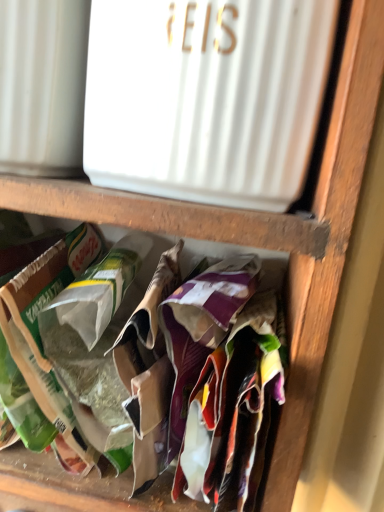
In order to face multicolored plastic bags at center, should I rotate leftwards or rightwards?

Rotate left and turn 13.545 degrees.

The image size is (384, 512). What do you see at coordinates (104, 397) in the screenshot?
I see `multicolored plastic bags at center` at bounding box center [104, 397].

What is the approximate width of multicolored plastic bags at center?

It is 6.44 inches.

This screenshot has height=512, width=384. In order to click on multicolored plastic bags at center in this screenshot , I will do `click(104, 397)`.

The height and width of the screenshot is (512, 384). In order to click on multicolored plastic bags at center in this screenshot , I will do `click(104, 397)`.